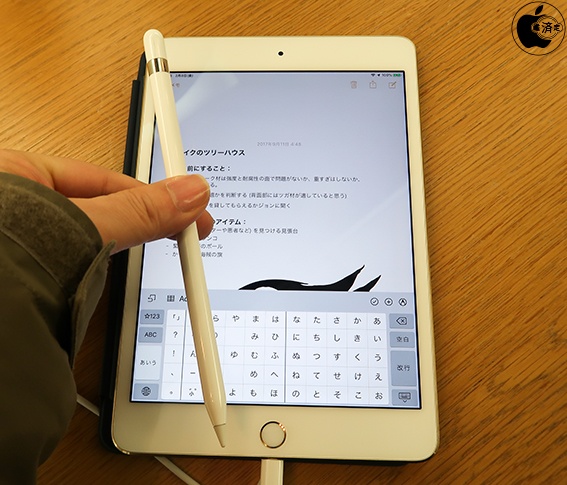
At what (x,y) coordinates should I click in order to perform the action: click on charger cord. Please return your answer as a coordinate pair (x, y). The image size is (567, 485). Looking at the image, I should click on (170, 465).